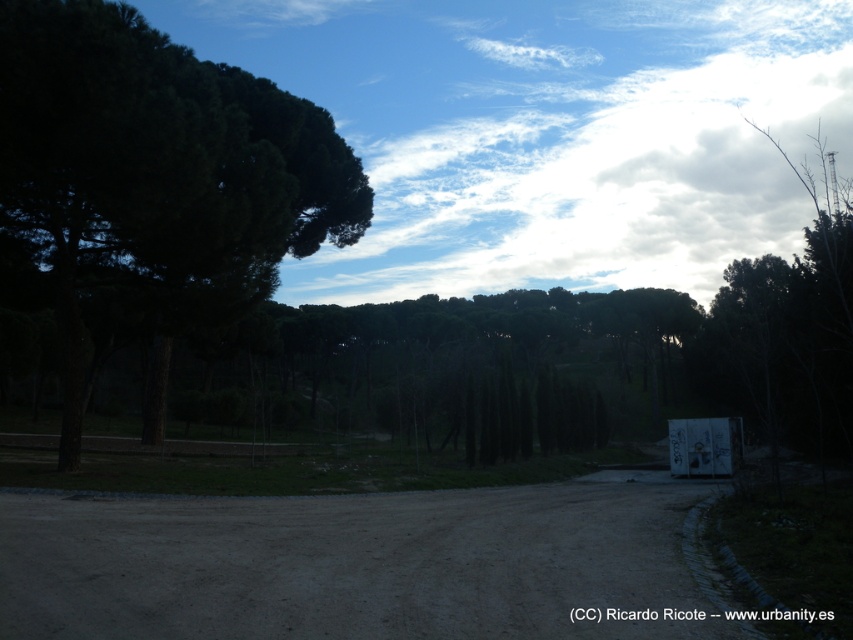
Between dirt track at center and dark green textured tree at left, which one is positioned lower?

dirt track at center is lower down.

The image size is (853, 640). What do you see at coordinates (354, 563) in the screenshot?
I see `dirt track at center` at bounding box center [354, 563].

Is point (4, 579) closer to camera compared to point (97, 40)?

Yes, it is in front of point (97, 40).

Find the location of a particular element. This screenshot has height=640, width=853. dirt track at center is located at coordinates (354, 563).